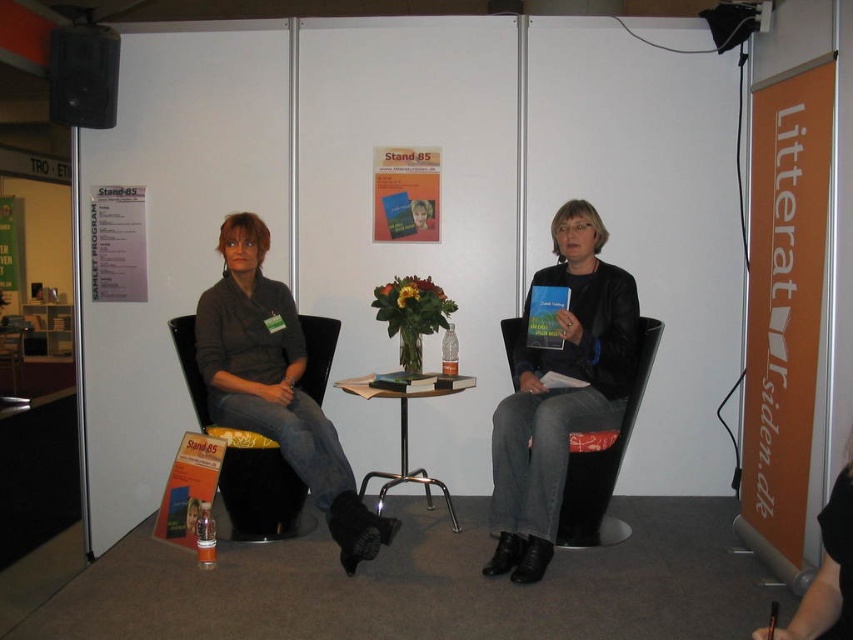
Does black matte speaker at upper left have a lesser width compared to wooden table at center?

Correct, black matte speaker at upper left's width is less than wooden table at center's.

Can you confirm if black matte speaker at upper left is positioned above wooden table at center?

Yes.

Which is in front, point (83, 65) or point (387, 484)?

Point (387, 484) is in front.

Locate an element on the screen. black matte speaker at upper left is located at coordinates (83, 76).

Between matte black sweater at center and wooden table at center, which one is positioned higher?

matte black sweater at center is above.

Is point (381, 538) less distant than point (430, 504)?

That is True.

Does point (349, 484) come in front of point (363, 378)?

Yes.

Locate an element on the screen. This screenshot has width=853, height=640. matte black sweater at center is located at coordinates (276, 385).

Does matte black sweater at center have a greater height compared to black fabric chair at left?

Indeed, matte black sweater at center has a greater height compared to black fabric chair at left.

From the picture: Is matte black sweater at center above black fabric chair at left?

Indeed, matte black sweater at center is positioned over black fabric chair at left.

Does point (320, 499) come behind point (293, 513)?

No.

This screenshot has height=640, width=853. I want to click on matte black sweater at center, so coord(276,385).